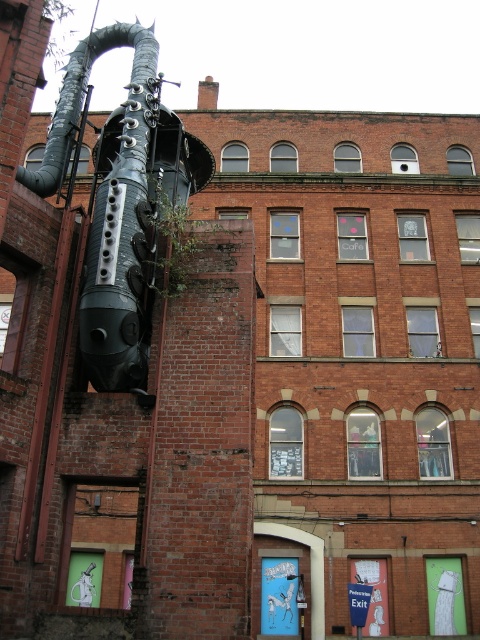
You are a GUI agent. You are given a task and a screenshot of the screen. Output one action in this format:
    pyautogui.click(x=<x>, y=<y>)
    Task: Click on the black matte pipe at left
    This screenshot has height=640, width=480.
    Given the screenshot: What is the action you would take?
    pyautogui.click(x=120, y=234)

Can you confirm if black matte pipe at left is positioned below black matte pipe at upper left?

Yes.

Image resolution: width=480 pixels, height=640 pixels. What do you see at coordinates (120, 234) in the screenshot?
I see `black matte pipe at left` at bounding box center [120, 234].

This screenshot has width=480, height=640. I want to click on black matte pipe at left, so pyautogui.click(x=120, y=234).